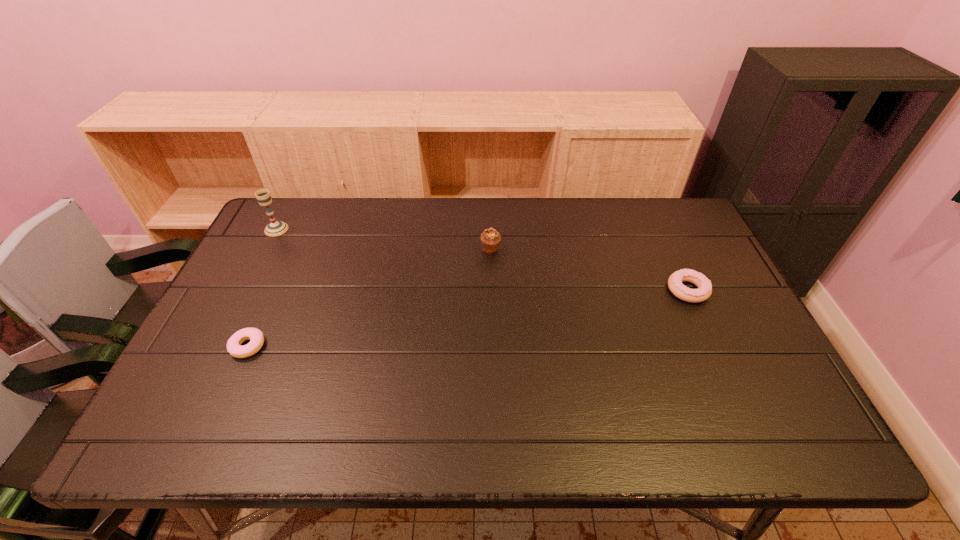
Find the location of a particular element. This screenshot has width=960, height=540. the farthest object is located at coordinates (275, 228).

Find the location of a particular element. The height and width of the screenshot is (540, 960). chalice is located at coordinates (275, 228).

At what (x,y) coordinates should I click in order to perform the action: click on the second farthest object. Please return your answer as a coordinate pair (x, y). Image resolution: width=960 pixels, height=540 pixels. Looking at the image, I should click on (490, 238).

Find the location of `the second tallest object`. the second tallest object is located at coordinates (490, 238).

Where is `the taller doughnut`? the taller doughnut is located at coordinates (704, 291).

The width and height of the screenshot is (960, 540). Identify the location of the rightmost object. (704, 291).

Where is `the left doughnut`? The width and height of the screenshot is (960, 540). the left doughnut is located at coordinates (256, 337).

The height and width of the screenshot is (540, 960). I want to click on the nearest object, so click(256, 337).

Identify the location of free space located on the right of the chalice. This screenshot has width=960, height=540. [376, 229].

The width and height of the screenshot is (960, 540). I want to click on vacant space located 0.290m on the left of the second object from right to left, so click(x=387, y=249).